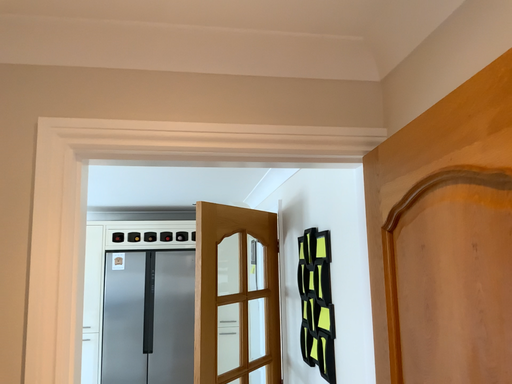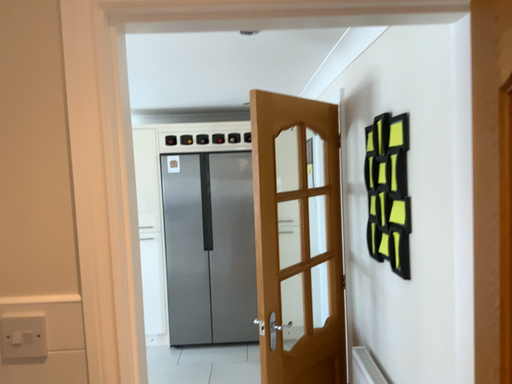
Question: Which way did the camera rotate in the video?

Choices:
 (A) rotated downward
 (B) rotated upward

Answer: (A)